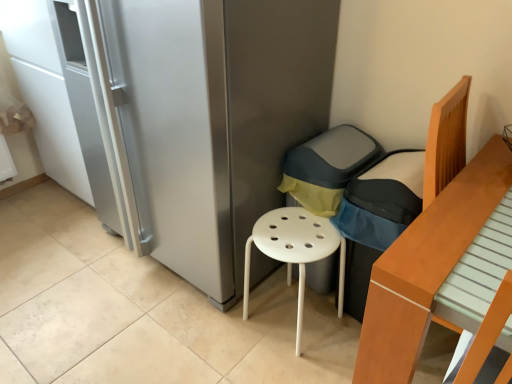
Question: Relative to satin silver fridge at center, is dark gray fabric armchair at center in front or behind?

Choices:
 (A) front
 (B) behind

Answer: (B)

Question: Considering the positions of dark gray fabric armchair at center and satin silver fridge at center in the image, is dark gray fabric armchair at center wider or thinner than satin silver fridge at center?

Choices:
 (A) thin
 (B) wide

Answer: (A)

Question: Which is nearer to the light brown wooden bed at right?

Choices:
 (A) dark gray fabric armchair at center
 (B) white plastic stool at center
 (C) satin silver fridge at center

Answer: (A)

Question: Which is nearer to the satin silver fridge at center?

Choices:
 (A) white plastic stool at center
 (B) dark gray fabric armchair at center
 (C) light brown wooden bed at right

Answer: (A)